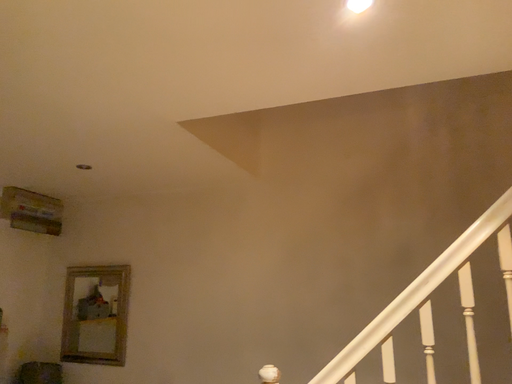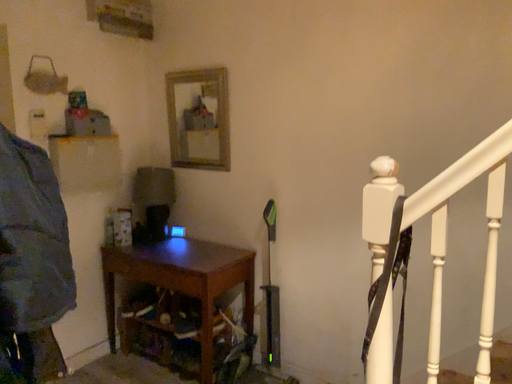
Question: Which way did the camera rotate in the video?

Choices:
 (A) rotated upward
 (B) rotated downward

Answer: (B)